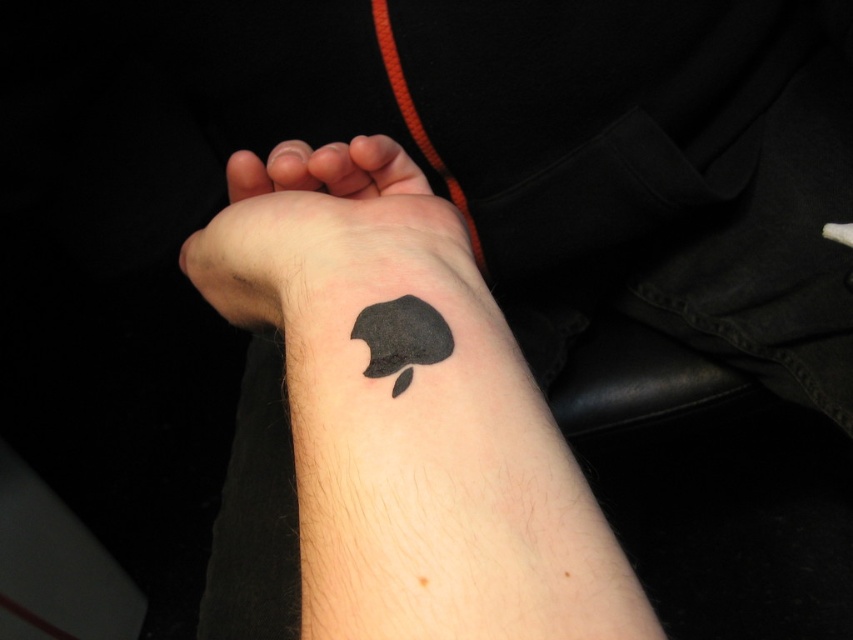
Question: Does black matte tattoo at lower center appear over black matte apple at lower center?

Choices:
 (A) yes
 (B) no

Answer: (B)

Question: Which object is farther from the camera taking this photo?

Choices:
 (A) black ink tattoo at lower center
 (B) black matte tattoo at lower center

Answer: (A)

Question: Does black matte tattoo at lower center have a smaller size compared to black matte apple at lower center?

Choices:
 (A) yes
 (B) no

Answer: (B)

Question: Is black matte tattoo at lower center positioned at the back of black matte apple at lower center?

Choices:
 (A) no
 (B) yes

Answer: (A)

Question: Which point is farther from the camera taking this photo?

Choices:
 (A) (437, 204)
 (B) (393, 346)
 (C) (389, 168)

Answer: (C)

Question: Which point is closer to the camera taking this photo?

Choices:
 (A) (437, 358)
 (B) (415, 378)

Answer: (B)